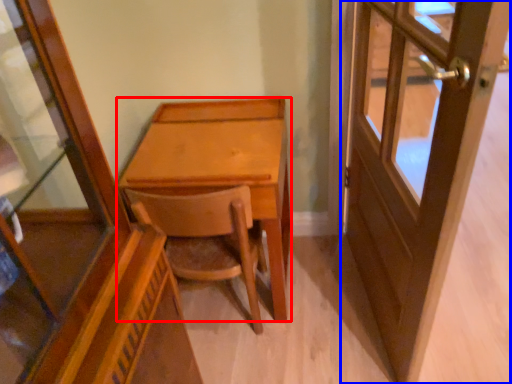
Question: Which object appears closest to the camera in this image, desk (highlighted by a red box) or door (highlighted by a blue box)?

Choices:
 (A) desk
 (B) door

Answer: (B)